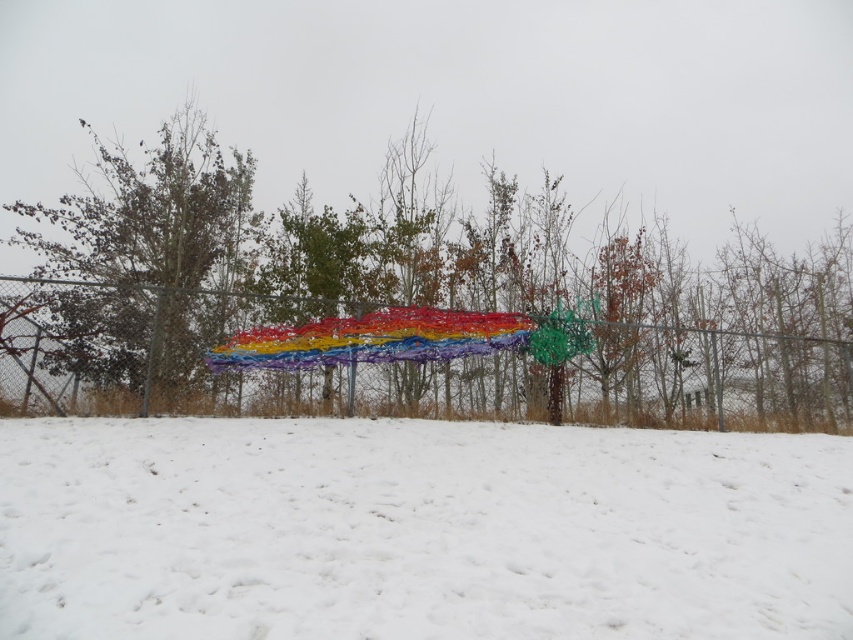
You are a photographer standing at the edge of the snowy landscape. You want to capture a photo where the multicolored wire sculpture at center is clearly visible behind the white fluffy snow at lower center. Is this possible given their positions?

The white fluffy snow at lower center is in front of the multicolored wire sculpture at center, so the snow may obscure the sculpture in the photo. To ensure the sculpture is visible behind the snow, you might need to adjust your angle or use a longer focal length to blur the foreground snow.

You are a delivery person trying to deliver a package to a house behind the brown textured tree at left. You are currently standing on the white fluffy snow at lower center. Can you walk straight towards the tree to reach the house? Why or why not?

The distance between the white fluffy snow at lower center and the brown textured tree at left is 10.97 meters. However, the scene description mentions a chain link fence running horizontally across the middle of the frame. Since the snow is at lower center and the tree is at left, it is likely that the fence is blocking the path. Therefore, you cannot walk straight towards the tree without crossing the fence.

You are standing in the snowy landscape and want to take a photo of the white fluffy snow at lower center and the brown textured tree at left. Which object will appear closer to the camera in the photo?

The white fluffy snow at lower center will appear closer to the camera because it is in front of the brown textured tree at left.